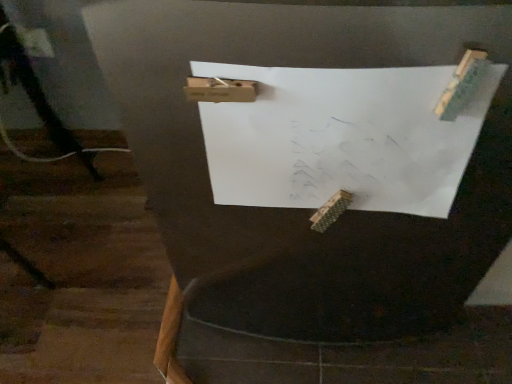
Question: Would you say black matte tripod at lower left contains white paper at center?

Choices:
 (A) no
 (B) yes

Answer: (A)

Question: Is black matte tripod at lower left not inside white paper at center?

Choices:
 (A) no
 (B) yes

Answer: (B)

Question: Does black matte tripod at lower left have a larger size compared to white paper at center?

Choices:
 (A) no
 (B) yes

Answer: (B)

Question: From the image's perspective, is black matte tripod at lower left located above white paper at center?

Choices:
 (A) no
 (B) yes

Answer: (B)

Question: From a real-world perspective, does black matte tripod at lower left sit lower than white paper at center?

Choices:
 (A) yes
 (B) no

Answer: (A)

Question: Can you confirm if black matte tripod at lower left is positioned to the right of white paper at center?

Choices:
 (A) no
 (B) yes

Answer: (A)

Question: Can we say white paper at center lies outside black matte tripod at lower left?

Choices:
 (A) no
 (B) yes

Answer: (B)

Question: Is white paper at center looking in the opposite direction of black matte tripod at lower left?

Choices:
 (A) yes
 (B) no

Answer: (B)

Question: Considering the relative sizes of white paper at center and black matte tripod at lower left in the image provided, is white paper at center bigger than black matte tripod at lower left?

Choices:
 (A) no
 (B) yes

Answer: (A)

Question: Could you tell me if white paper at center is facing black matte tripod at lower left?

Choices:
 (A) yes
 (B) no

Answer: (B)

Question: Does white paper at center come behind black matte tripod at lower left?

Choices:
 (A) no
 (B) yes

Answer: (A)

Question: Is white paper at center smaller than black matte tripod at lower left?

Choices:
 (A) yes
 (B) no

Answer: (A)

Question: Looking at their shapes, would you say white paper at center is wider or thinner than black matte tripod at lower left?

Choices:
 (A) wide
 (B) thin

Answer: (B)